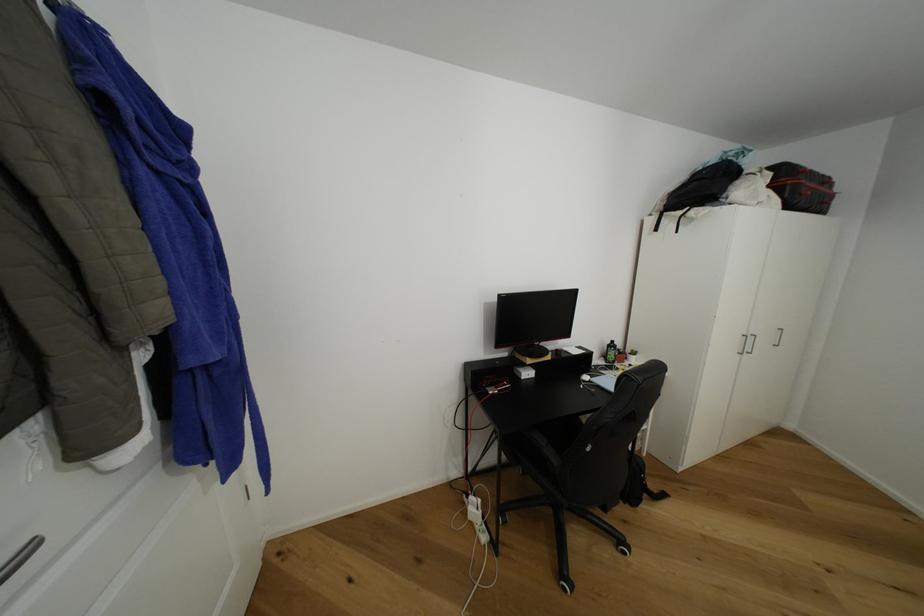
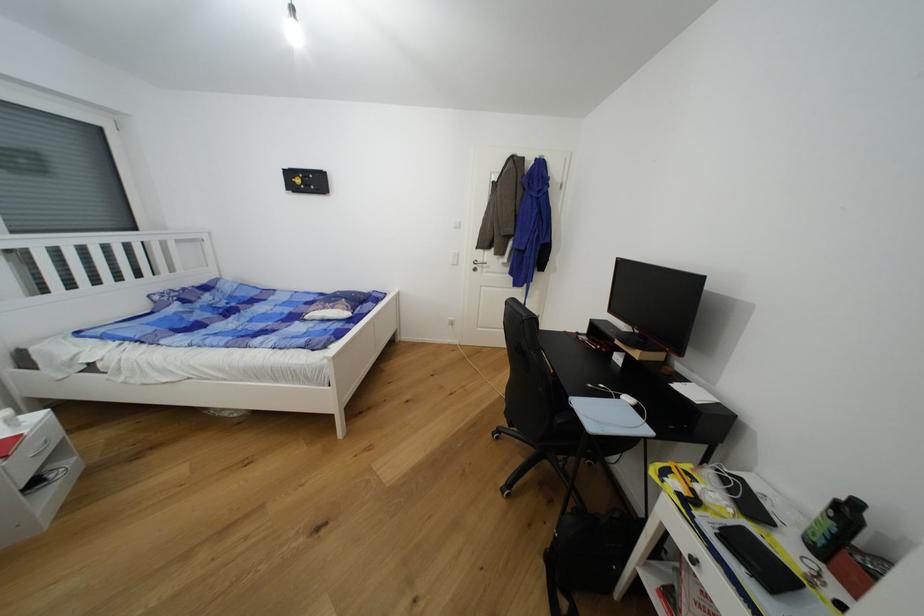
Where in the second image is the point corresponding to [617,342] from the first image?

(862, 506)